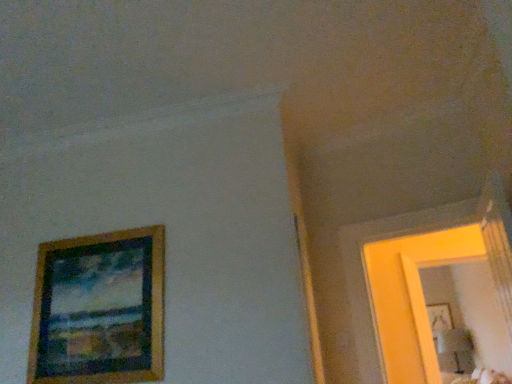
Question: From a real-world perspective, is matte yellow mirror at right on top of wooden picture frame at left, arranged as the first picture frame when viewed from the top?

Choices:
 (A) no
 (B) yes

Answer: (A)

Question: Is matte yellow mirror at right beside wooden picture frame at left, the second picture frame viewed from the right?

Choices:
 (A) yes
 (B) no

Answer: (B)

Question: Is matte yellow mirror at right turned away from wooden picture frame at left, the second picture frame viewed from the right?

Choices:
 (A) yes
 (B) no

Answer: (B)

Question: Is matte yellow mirror at right at the right side of wooden picture frame at left, marked as the 1th picture frame in a left-to-right arrangement?

Choices:
 (A) no
 (B) yes

Answer: (B)

Question: From the image's perspective, is matte yellow mirror at right under wooden picture frame at left, the first picture frame in the front-to-back sequence?

Choices:
 (A) yes
 (B) no

Answer: (A)

Question: Is matte yellow mirror at right facing towards wooden picture frame at left, arranged as the first picture frame when viewed from the top?

Choices:
 (A) yes
 (B) no

Answer: (B)

Question: Could wooden picture frame at upper right, acting as the 2th picture frame starting from the top, be considered to be inside matte yellow mirror at right?

Choices:
 (A) yes
 (B) no

Answer: (B)

Question: Considering the relative sizes of matte yellow mirror at right and wooden picture frame at upper right, the first picture frame in the bottom-to-top sequence, in the image provided, is matte yellow mirror at right thinner than wooden picture frame at upper right, the first picture frame in the bottom-to-top sequence,?

Choices:
 (A) no
 (B) yes

Answer: (A)

Question: Does matte yellow mirror at right appear on the left side of wooden picture frame at upper right, the second picture frame in the left-to-right sequence?

Choices:
 (A) yes
 (B) no

Answer: (A)

Question: Is matte yellow mirror at right positioned beyond the bounds of wooden picture frame at upper right, the first picture frame in the bottom-to-top sequence?

Choices:
 (A) yes
 (B) no

Answer: (A)

Question: From a real-world perspective, is matte yellow mirror at right positioned under wooden picture frame at upper right, the 1th picture frame from the back, based on gravity?

Choices:
 (A) no
 (B) yes

Answer: (B)

Question: Is matte yellow mirror at right directly adjacent to wooden picture frame at upper right, the second picture frame in the left-to-right sequence?

Choices:
 (A) no
 (B) yes

Answer: (A)

Question: Can you confirm if wooden picture frame at upper right, acting as the 2th picture frame starting from the top, is taller than wooden picture frame at left, marked as the 1th picture frame in a left-to-right arrangement?

Choices:
 (A) yes
 (B) no

Answer: (B)